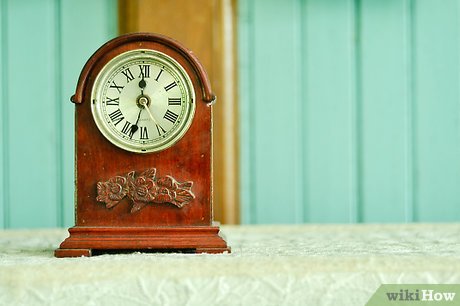
What are the coordinates of `light blue wall` in the screenshot? It's located at [300, 56].